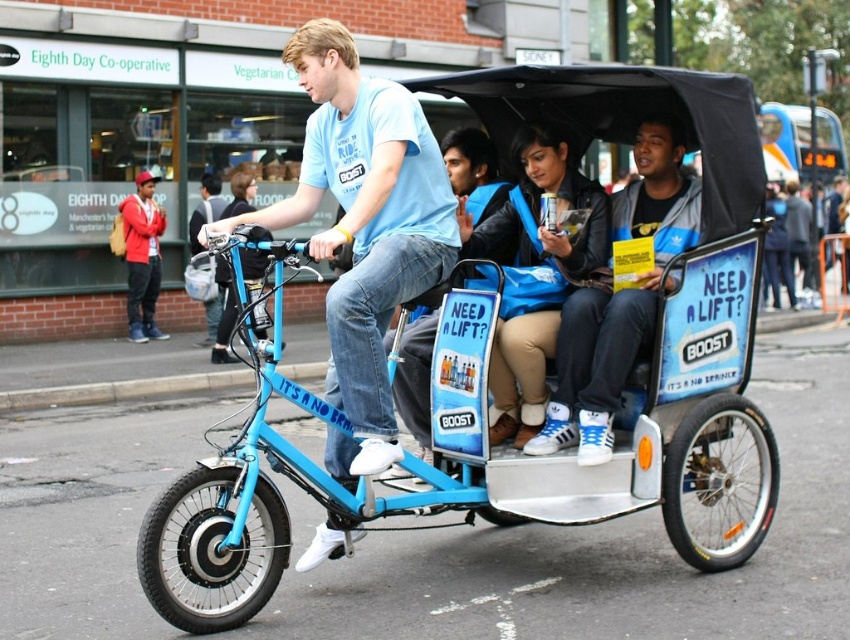
Question: Can you confirm if blue matte tricycle at center is wider than blue leather jacket at center?

Choices:
 (A) yes
 (B) no

Answer: (A)

Question: Does blue matte tricycle at center appear on the left side of blue leather jacket at center?

Choices:
 (A) yes
 (B) no

Answer: (A)

Question: Among these objects, which one is nearest to the camera?

Choices:
 (A) matte blue bicycle at center
 (B) blue matte tricycle at center
 (C) blue leather jacket at center

Answer: (A)

Question: Which of the following is the farthest from the observer?

Choices:
 (A) blue matte tricycle at center
 (B) matte blue bicycle at center

Answer: (A)

Question: Which of the following is the closest to the observer?

Choices:
 (A) (664, 189)
 (B) (320, 493)
 (C) (374, 202)

Answer: (C)

Question: Is blue matte tricycle at center to the right of matte blue bicycle at center from the viewer's perspective?

Choices:
 (A) no
 (B) yes

Answer: (B)